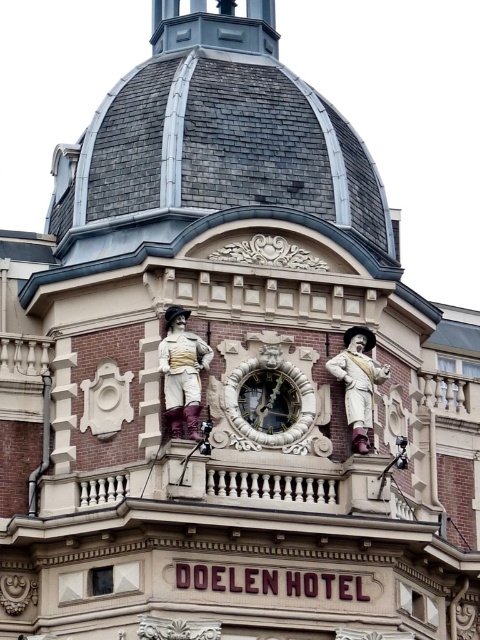
Is matte gold statue at center shorter than wooden statue at center?

No, matte gold statue at center is not shorter than wooden statue at center.

Is matte gold statue at center further to camera compared to wooden statue at center?

No, matte gold statue at center is closer to the viewer.

What do you see at coordinates (181, 372) in the screenshot? I see `matte gold statue at center` at bounding box center [181, 372].

At what (x,y) coordinates should I click in order to perform the action: click on matte gold statue at center. Please return your answer as a coordinate pair (x, y). Looking at the image, I should click on (181, 372).

Which is above, gold ornate clock at center or matte gold statue at center?

matte gold statue at center is above.

Is gold ornate clock at center wider than matte gold statue at center?

Correct, the width of gold ornate clock at center exceeds that of matte gold statue at center.

Between point (300, 396) and point (172, 419), which one is positioned in front?

Point (172, 419)

In order to click on gold ornate clock at center in this screenshot , I will do `click(268, 400)`.

Does point (300, 403) come in front of point (350, 378)?

No, (300, 403) is behind (350, 378).

Which is in front, point (291, 378) or point (343, 374)?

Point (343, 374) is more forward.

You are a GUI agent. You are given a task and a screenshot of the screen. Output one action in this format:
    pyautogui.click(x=<x>, y=<y>)
    Task: Click on the gold ornate clock at center
    This screenshot has height=640, width=480.
    Given the screenshot: What is the action you would take?
    pyautogui.click(x=268, y=400)